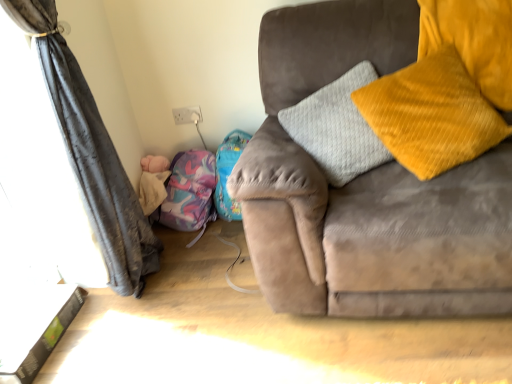
Question: In the image, is velvet yellow pillow at right on the left side or the right side of soft pink plush at lower left?

Choices:
 (A) right
 (B) left

Answer: (A)

Question: Does point (373, 119) appear closer or farther from the camera than point (156, 187)?

Choices:
 (A) farther
 (B) closer

Answer: (B)

Question: Which object is the closest to the soft pink plush at lower left?

Choices:
 (A) suede gray couch at right
 (B) dark grey fabric curtain at left
 (C) white glossy table at lower left
 (D) purple fabric bean bag chair at lower left
 (E) velvet yellow pillow at right

Answer: (D)

Question: Estimate the real-world distances between objects in this image. Which object is farther from the purple fabric bean bag chair at lower left?

Choices:
 (A) suede gray couch at right
 (B) white glossy table at lower left
 (C) velvet yellow pillow at right
 (D) soft pink plush at lower left
 (E) dark grey fabric curtain at left

Answer: (C)